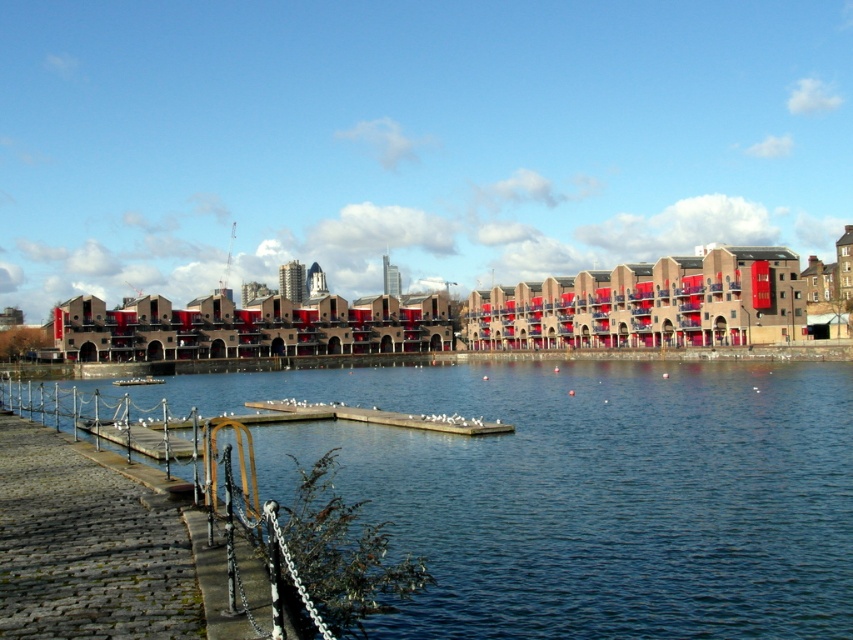
Question: Is brown cobblestone dock at lower left to the right of metallic silver boat at lower left from the viewer's perspective?

Choices:
 (A) no
 (B) yes

Answer: (B)

Question: Considering the relative positions of smooth concrete dock at lower left and brown cobblestone dock at lower left in the image provided, where is smooth concrete dock at lower left located with respect to brown cobblestone dock at lower left?

Choices:
 (A) below
 (B) above

Answer: (B)

Question: Which point is closer to the camera taking this photo?

Choices:
 (A) (x=830, y=564)
 (B) (x=10, y=429)

Answer: (A)

Question: Which point is farther to the camera?

Choices:
 (A) (120, 474)
 (B) (706, 406)

Answer: (B)

Question: Can you confirm if smooth concrete dock at lower left is wider than brown cobblestone dock at lower left?

Choices:
 (A) no
 (B) yes

Answer: (B)

Question: Which of the following is the farthest from the observer?

Choices:
 (A) (158, 376)
 (B) (51, 520)
 (C) (753, 490)

Answer: (A)